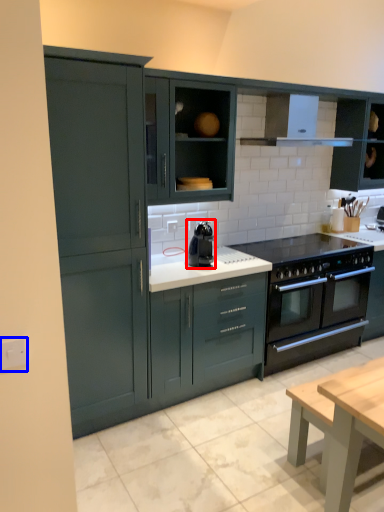
Question: Which object is further to the camera taking this photo, kitchen appliance (highlighted by a red box) or electric outlet (highlighted by a blue box)?

Choices:
 (A) kitchen appliance
 (B) electric outlet

Answer: (A)